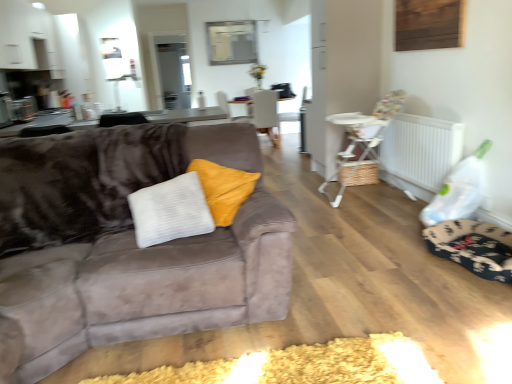
Question: From the image's perspective, is white plastic radiator at right beneath suede couch at left?

Choices:
 (A) no
 (B) yes

Answer: (A)

Question: Would you say white plastic radiator at right is a long distance from suede couch at left?

Choices:
 (A) yes
 (B) no

Answer: (A)

Question: Does white plastic radiator at right come behind suede couch at left?

Choices:
 (A) yes
 (B) no

Answer: (A)

Question: Could you tell me if white plastic radiator at right is turned towards suede couch at left?

Choices:
 (A) yes
 (B) no

Answer: (A)

Question: Does white plastic radiator at right have a greater width compared to suede couch at left?

Choices:
 (A) yes
 (B) no

Answer: (B)

Question: In terms of height, does suede couch at left look taller or shorter compared to floral fabric dog bed at lower right?

Choices:
 (A) tall
 (B) short

Answer: (A)

Question: From the image's perspective, is suede couch at left located above or below floral fabric dog bed at lower right?

Choices:
 (A) above
 (B) below

Answer: (A)

Question: Is suede couch at left situated inside floral fabric dog bed at lower right or outside?

Choices:
 (A) outside
 (B) inside

Answer: (A)

Question: Is point (132, 236) positioned closer to the camera than point (424, 240)?

Choices:
 (A) farther
 (B) closer

Answer: (B)

Question: Is white woven basket at center situated inside white plastic highchair at right, placed as the 2th chair when sorted from back to front, or outside?

Choices:
 (A) inside
 (B) outside

Answer: (B)

Question: Considering the positions of white woven basket at center and white plastic highchair at right, the 1th chair from the front, in the image, is white woven basket at center bigger or smaller than white plastic highchair at right, the 1th chair from the front,?

Choices:
 (A) small
 (B) big

Answer: (A)

Question: Considering the positions of white woven basket at center and white plastic highchair at right, placed as the 1th chair when sorted from right to left, in the image, is white woven basket at center taller or shorter than white plastic highchair at right, placed as the 1th chair when sorted from right to left,?

Choices:
 (A) tall
 (B) short

Answer: (B)

Question: Based on their positions, is white woven basket at center located to the left or right of white plastic highchair at right, placed as the 2th chair when sorted from back to front?

Choices:
 (A) left
 (B) right

Answer: (B)

Question: Is white plastic highchair at right, placed as the 1th chair when sorted from right to left, situated inside white fabric armchair at center or outside?

Choices:
 (A) outside
 (B) inside

Answer: (A)

Question: From the image's perspective, is white plastic highchair at right, the 1th chair from the front, positioned above or below white fabric armchair at center?

Choices:
 (A) above
 (B) below

Answer: (B)